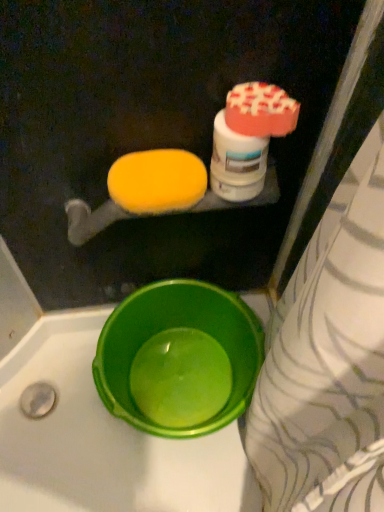
Question: From a real-world perspective, is white glossy bottle at upper right located higher than yellow sponge at upper left?

Choices:
 (A) yes
 (B) no

Answer: (A)

Question: From the image's perspective, is white glossy bottle at upper right over yellow sponge at upper left?

Choices:
 (A) yes
 (B) no

Answer: (A)

Question: Is yellow sponge at upper left at the back of white glossy bottle at upper right?

Choices:
 (A) no
 (B) yes

Answer: (A)

Question: Is white glossy bottle at upper right positioned behind yellow sponge at upper left?

Choices:
 (A) no
 (B) yes

Answer: (A)

Question: Is white glossy bottle at upper right at the right side of yellow sponge at upper left?

Choices:
 (A) yes
 (B) no

Answer: (A)

Question: Does point (175, 287) appear closer or farther from the camera than point (170, 195)?

Choices:
 (A) farther
 (B) closer

Answer: (A)

Question: Would you say green plastic basin at lower left is inside or outside yellow sponge at upper left?

Choices:
 (A) inside
 (B) outside

Answer: (B)

Question: In the image, is green plastic basin at lower left positioned in front of or behind yellow sponge at upper left?

Choices:
 (A) front
 (B) behind

Answer: (B)

Question: Considering the relative positions of green plastic basin at lower left and yellow sponge at upper left in the image provided, is green plastic basin at lower left to the left or to the right of yellow sponge at upper left?

Choices:
 (A) right
 (B) left

Answer: (A)

Question: In the image, is yellow sponge at upper left positioned in front of or behind white glossy bottle at upper right?

Choices:
 (A) behind
 (B) front

Answer: (A)

Question: Visually, is yellow sponge at upper left positioned to the left or to the right of white glossy bottle at upper right?

Choices:
 (A) left
 (B) right

Answer: (A)

Question: Is yellow sponge at upper left bigger or smaller than white glossy bottle at upper right?

Choices:
 (A) small
 (B) big

Answer: (A)

Question: Which is correct: yellow sponge at upper left is inside white glossy bottle at upper right, or outside of it?

Choices:
 (A) outside
 (B) inside

Answer: (A)

Question: In terms of width, does white glossy bottle at upper right look wider or thinner when compared to green plastic basin at lower left?

Choices:
 (A) thin
 (B) wide

Answer: (A)

Question: Considering the positions of point (256, 90) and point (137, 426), is point (256, 90) closer or farther from the camera than point (137, 426)?

Choices:
 (A) closer
 (B) farther

Answer: (A)